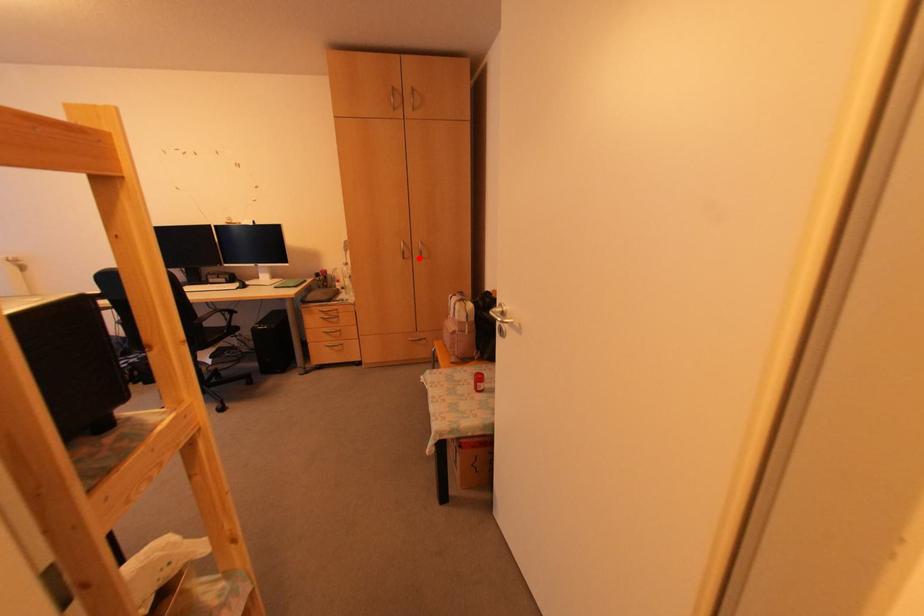
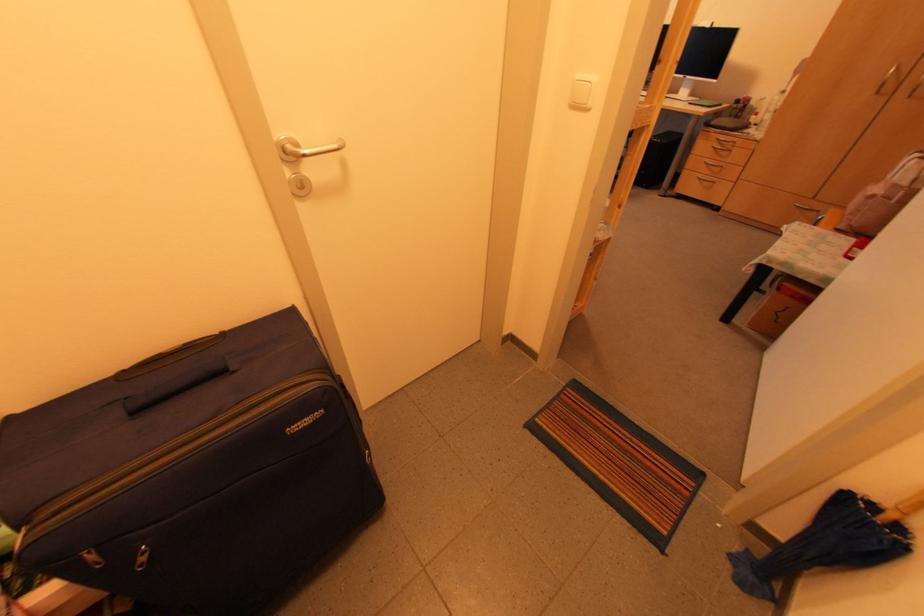
The point at the highlighted location is marked in the first image. Where is the corresponding point in the second image?

(907, 97)